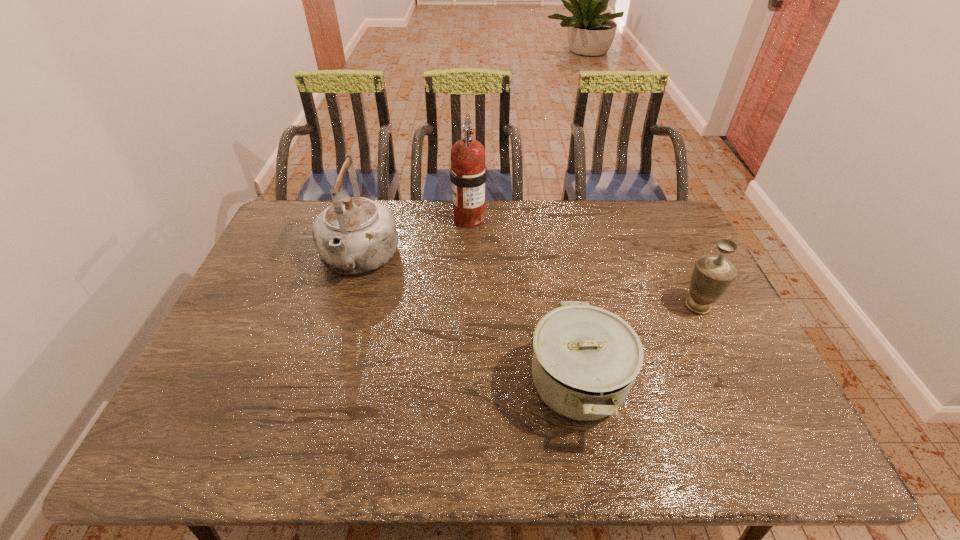
Locate an element on the screen. The height and width of the screenshot is (540, 960). vacant area situated on the front of the urn is located at coordinates (740, 394).

Identify the location of vacant space located on the left of the shortest object. Image resolution: width=960 pixels, height=540 pixels. (447, 383).

Locate an element on the screen. This screenshot has height=540, width=960. fire extinguisher that is at the far edge is located at coordinates 468,173.

Find the location of a particular element. The height and width of the screenshot is (540, 960). kettle at the far edge is located at coordinates (355, 235).

At what (x,y) coordinates should I click in order to perform the action: click on object located in the near edge section of the desktop. Please return your answer as a coordinate pair (x, y). Looking at the image, I should click on (585, 360).

Identify the location of object present at the right edge. The image size is (960, 540). (712, 275).

At what (x,y) coordinates should I click in order to perform the action: click on vacant space at the far edge of the desktop. Please return your answer as a coordinate pair (x, y). Looking at the image, I should click on (424, 215).

Identify the location of vacant space at the near edge of the desktop. (259, 438).

Where is `free space at the left edge`? The width and height of the screenshot is (960, 540). free space at the left edge is located at coordinates (214, 389).

At what (x,y) coordinates should I click in order to perform the action: click on free region at the right edge of the desktop. Please return your answer as a coordinate pair (x, y). The image size is (960, 540). Looking at the image, I should click on (668, 272).